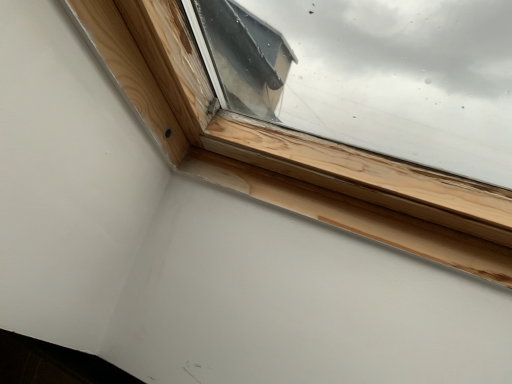
Question: Should I look upward or downward to see natural wood window sill at upper right?

Choices:
 (A) up
 (B) down

Answer: (B)